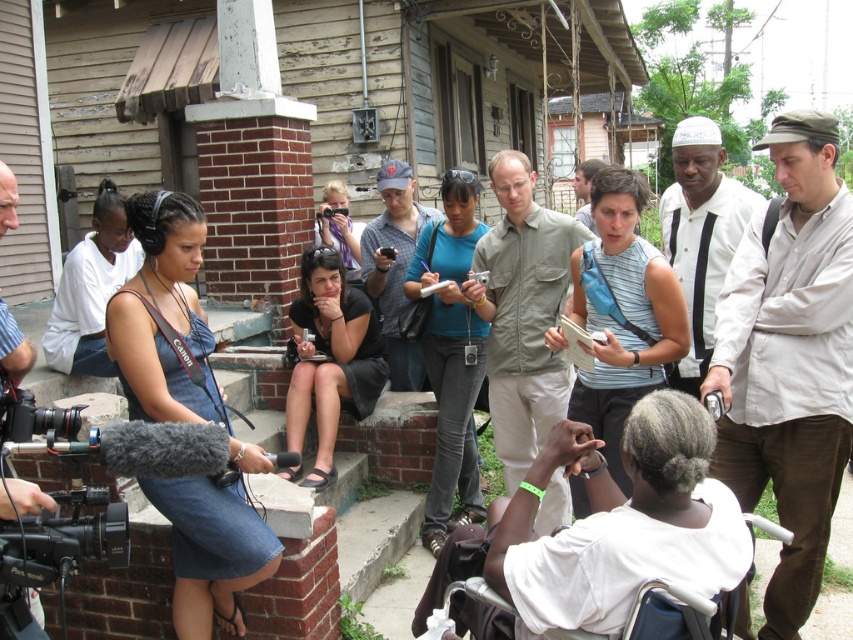
Is the position of white matte shirt at center-right more distant than that of matte gray cap at center?

No, white matte shirt at center-right is in front of matte gray cap at center.

Is white matte shirt at center-right wider than matte gray cap at center?

Correct, the width of white matte shirt at center-right exceeds that of matte gray cap at center.

The image size is (853, 640). Find the location of `white matte shirt at center-right`. white matte shirt at center-right is located at coordinates (700, 234).

Between khaki cotton shirt at center and white matte shirt at center-right, which one is positioned lower?

khaki cotton shirt at center is lower down.

Does khaki cotton shirt at center lie behind white matte shirt at center-right?

Yes.

Describe the element at coordinates (521, 314) in the screenshot. The width and height of the screenshot is (853, 640). I see `khaki cotton shirt at center` at that location.

Where is `khaki cotton shirt at center`? The image size is (853, 640). khaki cotton shirt at center is located at coordinates pyautogui.click(x=521, y=314).

Which is behind, point (746, 627) or point (500, 323)?

The point (500, 323) is behind.

Which is above, light beige shirt at center or khaki cotton shirt at center?

khaki cotton shirt at center is above.

This screenshot has height=640, width=853. What are the coordinates of `light beige shirt at center` in the screenshot? It's located at (788, 358).

Where is `light beige shirt at center`? The width and height of the screenshot is (853, 640). light beige shirt at center is located at coordinates (788, 358).